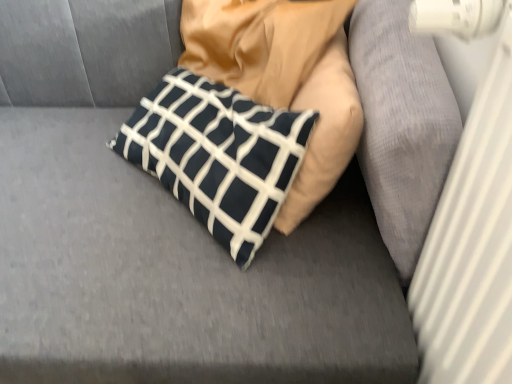
Where is `black woven cushion at center`? This screenshot has height=384, width=512. black woven cushion at center is located at coordinates (401, 124).

What do you see at coordinates (401, 124) in the screenshot? I see `black woven cushion at center` at bounding box center [401, 124].

In order to face black woven cushion at center, should I rotate leftwards or rightwards?

Turn right approximately 16.280 degrees to face it.

You are a GUI agent. You are given a task and a screenshot of the screen. Output one action in this format:
    pyautogui.click(x=<x>, y=<y>)
    Task: Click on the black woven cushion at center
    This screenshot has width=512, height=384.
    Given the screenshot: What is the action you would take?
    pyautogui.click(x=401, y=124)